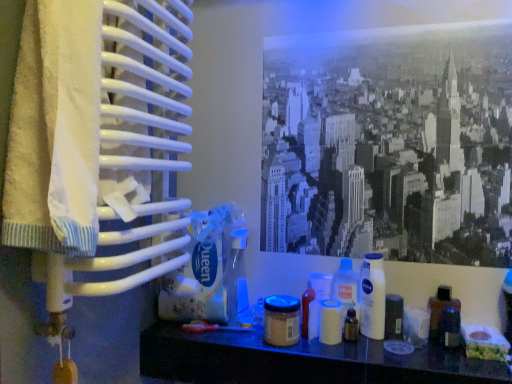
Locate an element on the screen. Image resolution: width=512 pixels, height=384 pixels. free space on the front side of translucent plastic bottle at lower right, the second bottle when ordered from left to right is located at coordinates (452, 364).